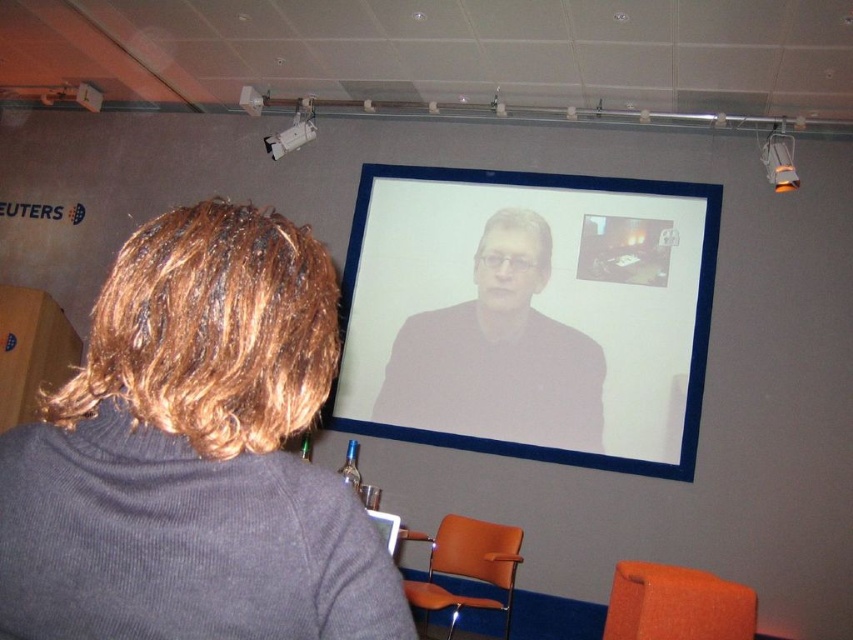
Is orange leather chair at lower right to the right of white plastic projector at upper center from the viewer's perspective?

Indeed, orange leather chair at lower right is positioned on the right side of white plastic projector at upper center.

Is orange leather chair at lower right in front of white plastic projector at upper center?

Yes, it is.

Find the location of a particular element. Image resolution: width=853 pixels, height=640 pixels. orange leather chair at lower right is located at coordinates (468, 566).

Is orange fabric chair at lower right to the left of orange leather chair at lower right from the viewer's perspective?

Incorrect, orange fabric chair at lower right is not on the left side of orange leather chair at lower right.

Who is lower down, orange fabric chair at lower right or orange leather chair at lower right?

Positioned lower is orange leather chair at lower right.

Which is behind, point (622, 580) or point (425, 616)?

The point (425, 616) is more distant.

The height and width of the screenshot is (640, 853). Find the location of `orange fabric chair at lower right`. orange fabric chair at lower right is located at coordinates (676, 604).

Is gray ribbed sweater at lower left smaller than white plastic projector at upper center?

No, gray ribbed sweater at lower left is not smaller than white plastic projector at upper center.

Is point (212, 630) positioned after point (283, 140)?

No, (212, 630) is in front of (283, 140).

Between point (85, 408) and point (294, 145), which one is positioned behind?

Positioned behind is point (294, 145).

Where is `gray ribbed sweater at lower left`? gray ribbed sweater at lower left is located at coordinates (194, 454).